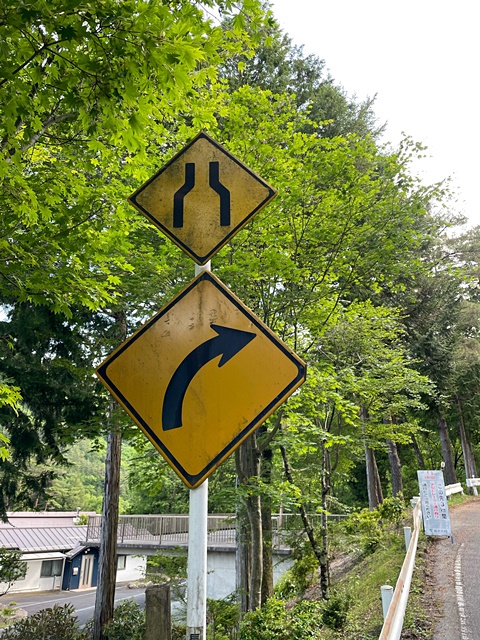
At what (x,y) coordinates should I click in order to perform the action: click on windows. Please return your answer as a coordinate pair (x, y). The width and height of the screenshot is (480, 640). Looking at the image, I should click on (120, 564), (54, 570), (45, 566).